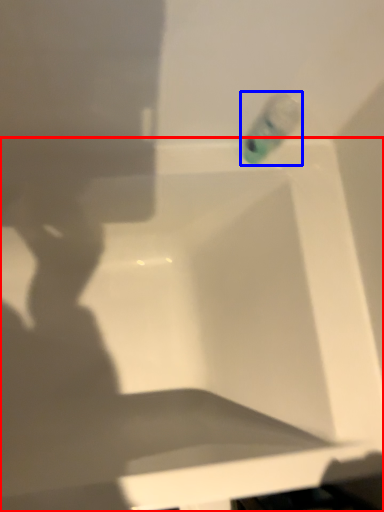
Question: Among these objects, which one is farthest to the camera, bathtub (highlighted by a red box) or liquid (highlighted by a blue box)?

Choices:
 (A) bathtub
 (B) liquid

Answer: (B)